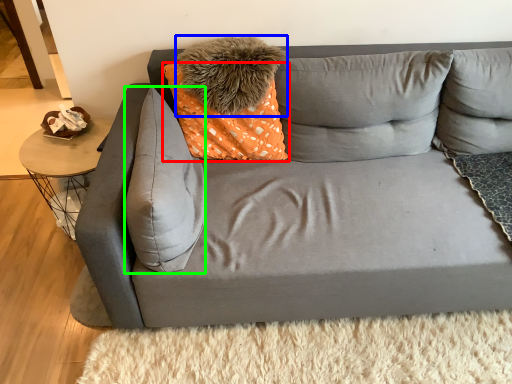
Question: Which is farther away from pillow (highlighted by a red box)? pillow (highlighted by a blue box) or pillow (highlighted by a green box)?

Choices:
 (A) pillow
 (B) pillow

Answer: (B)